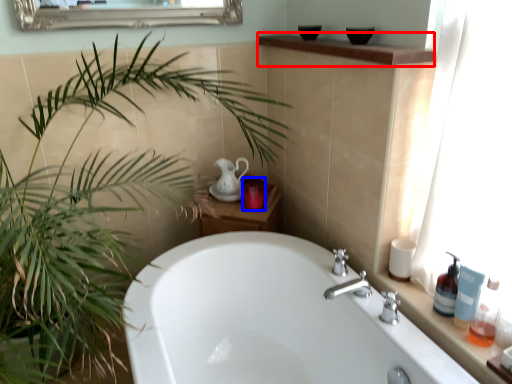
Question: Which point is further to the camera, counter top (highlighted by a red box) or toiletry (highlighted by a blue box)?

Choices:
 (A) counter top
 (B) toiletry

Answer: (B)